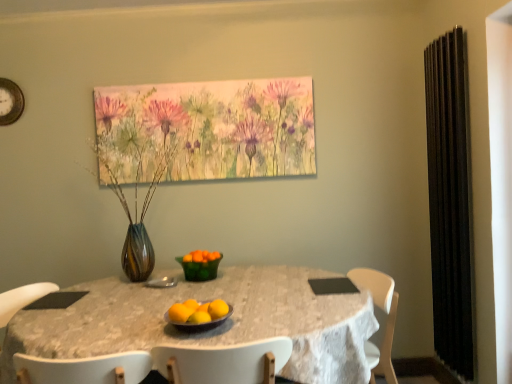
This screenshot has width=512, height=384. In order to click on vacant area that lies in front of multicolored glass vase with dried stems at center in this screenshot , I will do `click(113, 296)`.